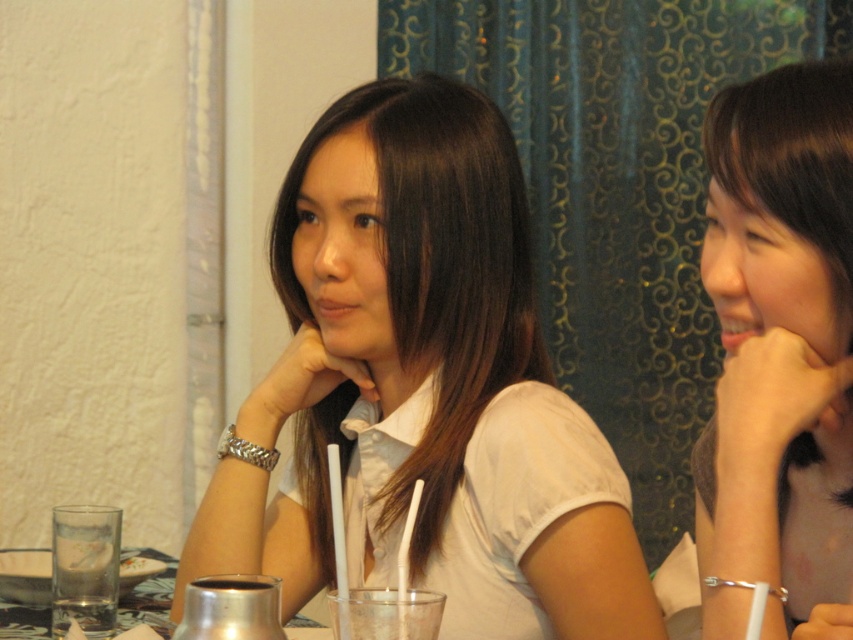
Is white matte shirt at upper right closer to camera compared to metallic silver carafe at lower center?

Yes, white matte shirt at upper right is closer to the viewer.

Can you confirm if white matte shirt at upper right is bigger than metallic silver carafe at lower center?

Yes, white matte shirt at upper right is bigger than metallic silver carafe at lower center.

Image resolution: width=853 pixels, height=640 pixels. What are the coordinates of `white matte shirt at upper right` in the screenshot? It's located at (778, 358).

This screenshot has height=640, width=853. I want to click on white matte shirt at upper right, so click(x=778, y=358).

Is white matte shirt at center further to the viewer compared to white matte shirt at upper right?

Yes.

Which is more to the left, white matte shirt at center or white matte shirt at upper right?

Positioned to the left is white matte shirt at center.

Identify the location of white matte shirt at center. The height and width of the screenshot is (640, 853). (422, 388).

Who is positioned more to the right, white matte shirt at center or metallic silver carafe at lower center?

white matte shirt at center

What do you see at coordinates (422, 388) in the screenshot? This screenshot has width=853, height=640. I see `white matte shirt at center` at bounding box center [422, 388].

Where is `white matte shirt at center`? This screenshot has height=640, width=853. white matte shirt at center is located at coordinates (422, 388).

You are a GUI agent. You are given a task and a screenshot of the screen. Output one action in this format:
    pyautogui.click(x=<x>, y=<y>)
    Task: Click on the white matte shirt at center
    
    Given the screenshot: What is the action you would take?
    pyautogui.click(x=422, y=388)